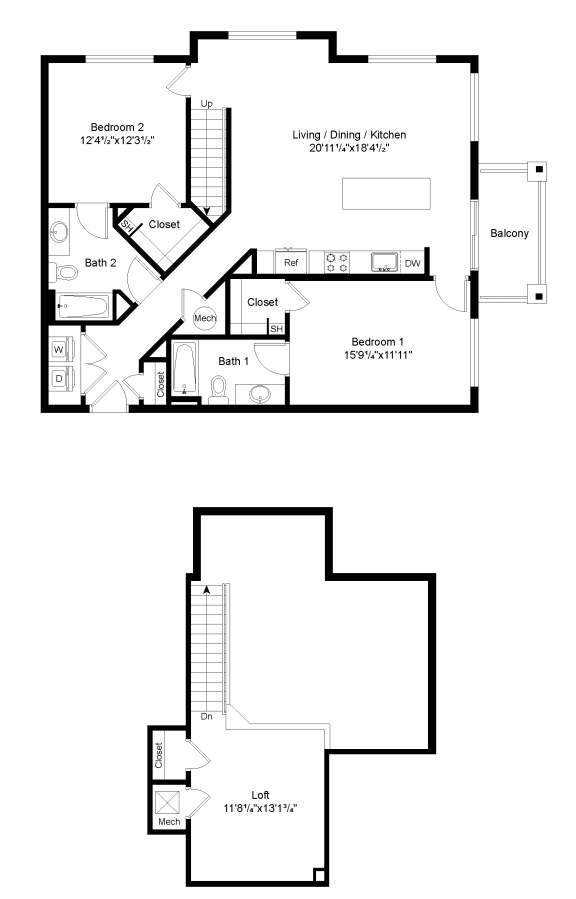
The width and height of the screenshot is (576, 899). I want to click on closets, so click(x=173, y=760), click(x=257, y=292), click(x=164, y=228).